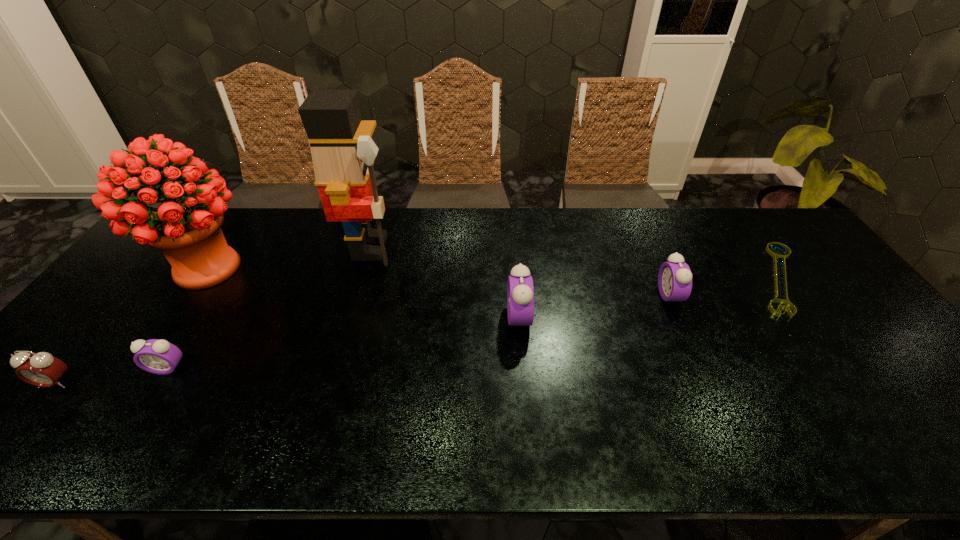
This screenshot has height=540, width=960. In order to click on vacant space located on the right of the bouquet in this screenshot , I will do `click(302, 268)`.

The image size is (960, 540). I want to click on blank area located on the clock face of the leftmost alarm clock, so click(x=31, y=414).

I want to click on nutcracker that is at the far edge, so click(343, 153).

Identify the location of wrench present at the far edge. 781,256.

Identify the location of bouquet at the far edge. Image resolution: width=960 pixels, height=540 pixels. (188, 232).

This screenshot has height=540, width=960. I want to click on object present at the near edge, so click(41, 369).

Identify the location of bouquet that is at the left edge. (188, 232).

Find the location of `alarm clock present at the left edge`. alarm clock present at the left edge is located at coordinates (41, 369).

Where is `object that is at the right edge`? Image resolution: width=960 pixels, height=540 pixels. object that is at the right edge is located at coordinates (781, 256).

Find the location of a particular element. The height and width of the screenshot is (540, 960). object that is at the far left corner is located at coordinates (188, 232).